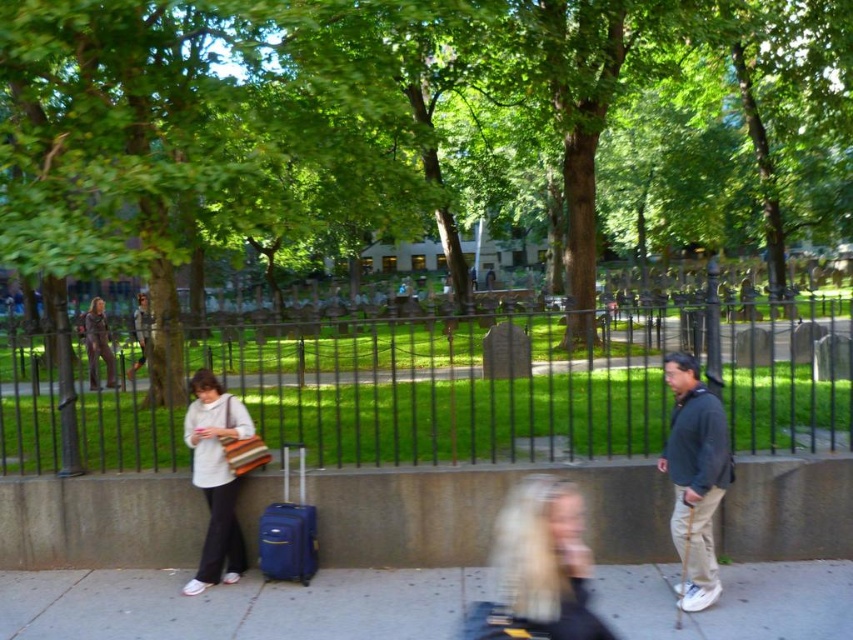
Is point (360, 618) behind point (219, 387)?

No, (360, 618) is closer to viewer.

This screenshot has width=853, height=640. Describe the element at coordinates (234, 605) in the screenshot. I see `smooth concrete sidewalk at center` at that location.

The width and height of the screenshot is (853, 640). What are the coordinates of `smooth concrete sidewalk at center` in the screenshot? It's located at (234, 605).

Image resolution: width=853 pixels, height=640 pixels. I want to click on smooth concrete sidewalk at center, so click(234, 605).

Does striped fabric bag at center appear on the right side of matte brown pants at center?

Correct, you'll find striped fabric bag at center to the right of matte brown pants at center.

Is striped fabric bag at center shorter than matte brown pants at center?

Correct, striped fabric bag at center is not as tall as matte brown pants at center.

Where is `striped fabric bag at center`? The width and height of the screenshot is (853, 640). striped fabric bag at center is located at coordinates (215, 477).

Which is below, blonde hair at center or striped fabric bag at center?

striped fabric bag at center is lower down.

Does blonde hair at center appear on the right side of striped fabric bag at center?

Yes, blonde hair at center is to the right of striped fabric bag at center.

Does point (531, 557) come closer to viewer compared to point (201, 397)?

That is True.

At what (x,y) coordinates should I click in order to perform the action: click on blonde hair at center. Please return your answer as a coordinate pair (x, y). The image size is (853, 640). Looking at the image, I should click on (538, 568).